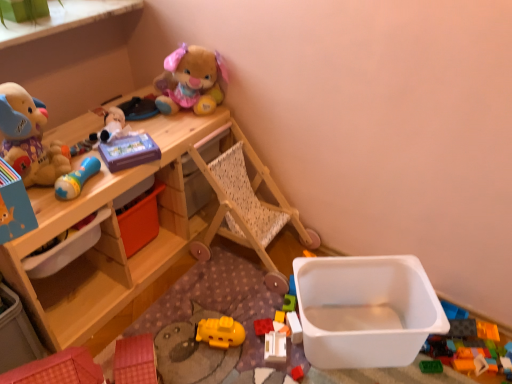
Identify the location of free spot to the left of yellow plastic submarine at center, which ranks as the fourth toy in bottom-to-top order. This screenshot has width=512, height=384. (174, 335).